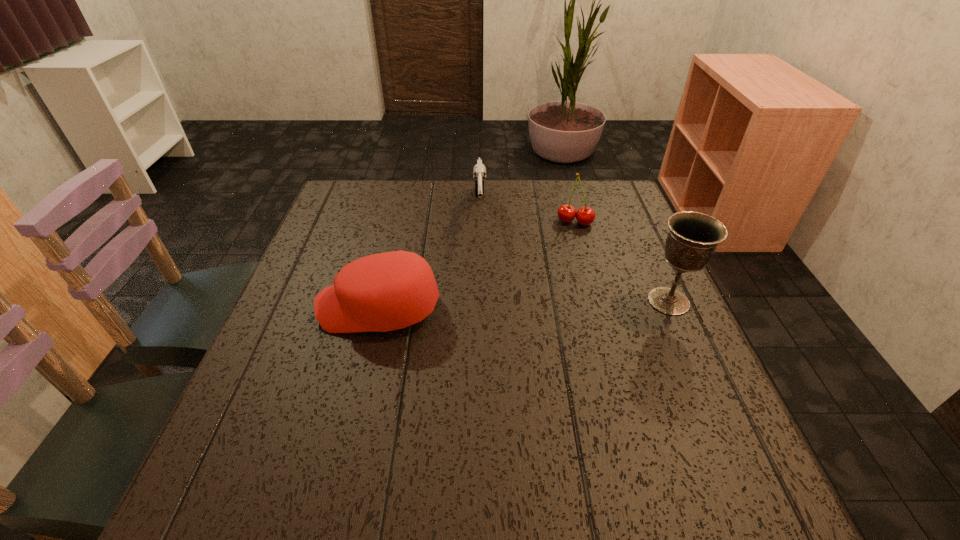
In order to click on free space on the desktop that is between the leftmost object and the rightmost object and is positioned with the stems of the third object from left to right pointing upwards in this screenshot , I will do `click(562, 303)`.

The height and width of the screenshot is (540, 960). Find the location of `free space on the desktop that is between the leftmost object and the tallest object and is positioned at the muzzle of the third object from right to left`. free space on the desktop that is between the leftmost object and the tallest object and is positioned at the muzzle of the third object from right to left is located at coordinates coord(486,306).